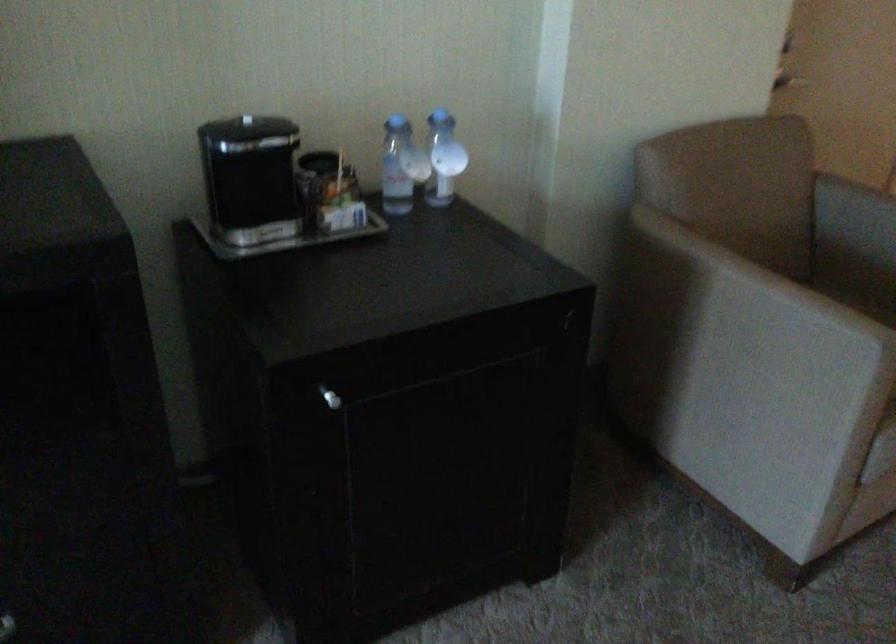
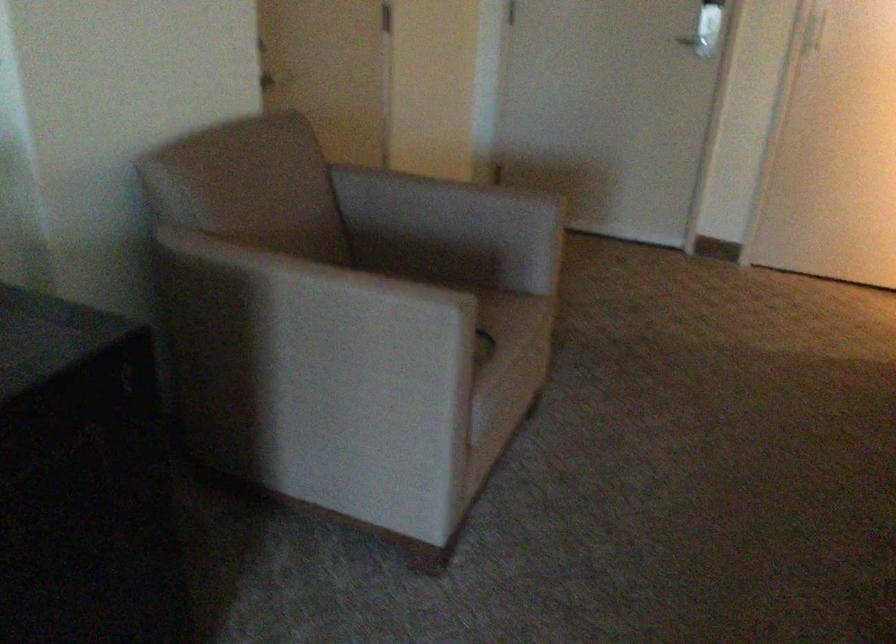
The point at [737,319] is marked in the first image. Where is the corresponding point in the second image?

(314, 325)